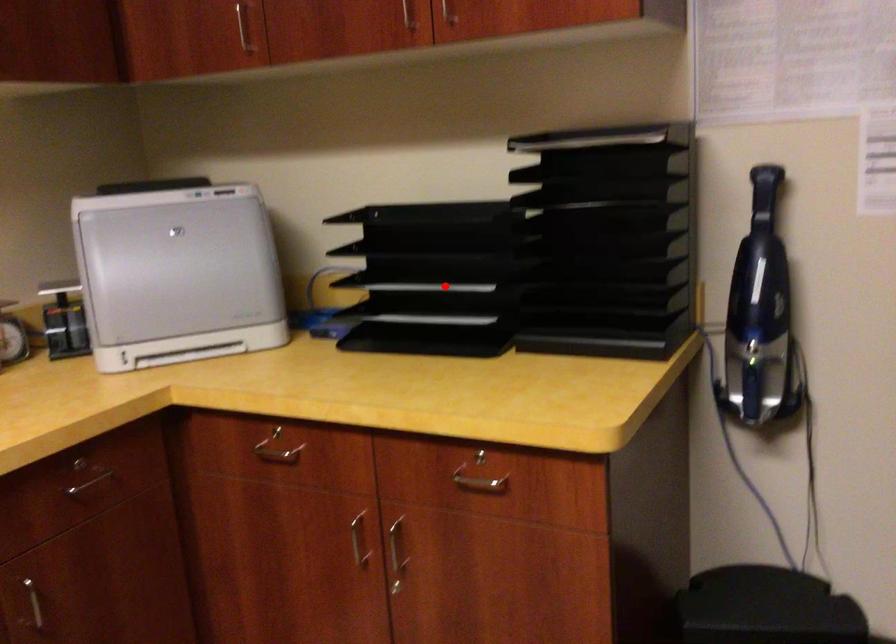
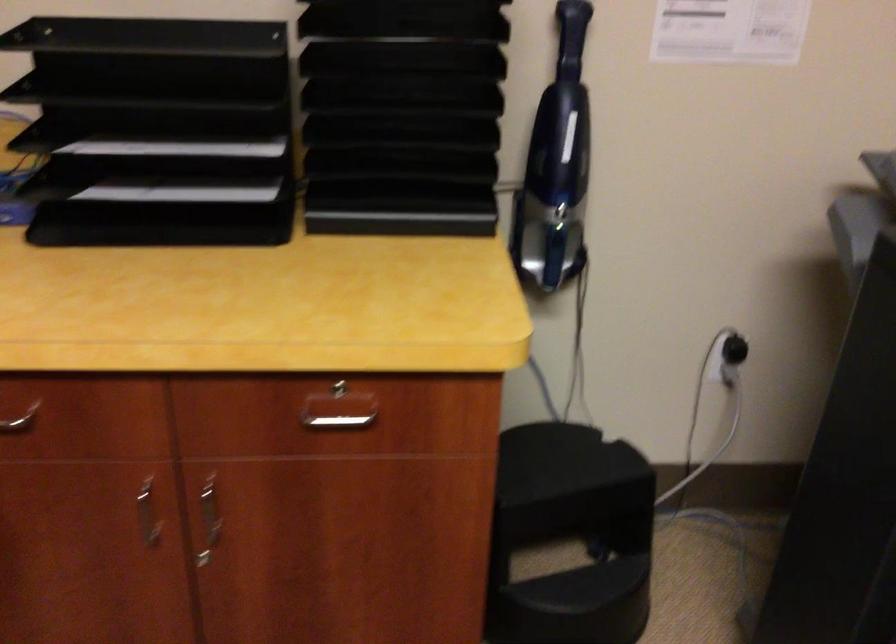
In the second image, find the point that corresponds to the highlighted location in the first image.

(177, 145)